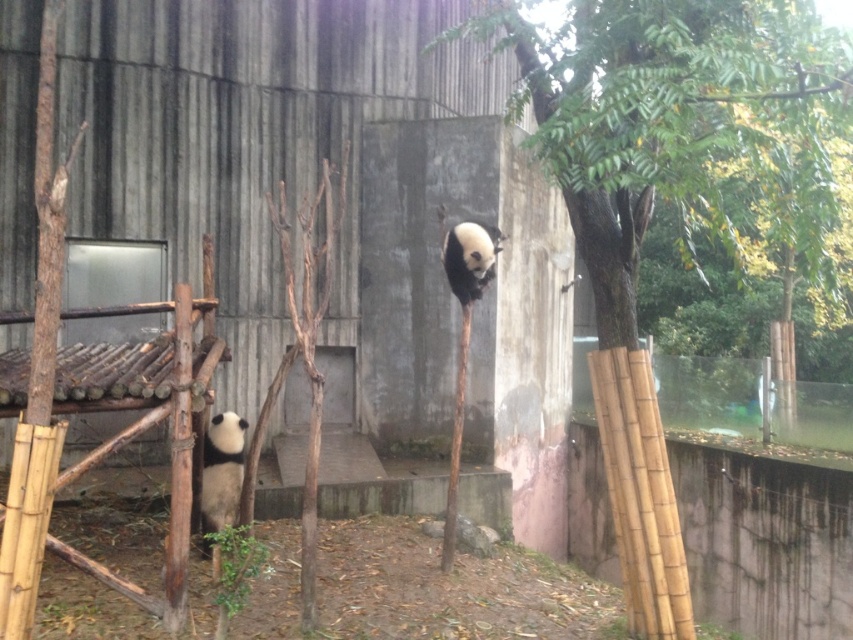
Between black and white fur panda at lower left and white fur panda at upper center, which one has more height?

black and white fur panda at lower left is taller.

Between black and white fur panda at lower left and white fur panda at upper center, which one is positioned higher?

white fur panda at upper center is higher up.

Between point (233, 445) and point (462, 273), which one is positioned behind?

Point (462, 273)

Find the location of a particular element. black and white fur panda at lower left is located at coordinates (221, 472).

Is point (715, 189) in front of point (498, 236)?

Yes, it is in front of point (498, 236).

Is point (560, 81) farther from camera compared to point (448, 268)?

No, it is in front of (448, 268).

Is point (811, 113) in front of point (474, 288)?

Yes, it is.

I want to click on green leafy tree at upper right, so click(x=675, y=122).

Is point (693, 634) more distant than point (206, 492)?

No, (693, 634) is in front of (206, 492).

Can you confirm if green leafy tree at upper right is wider than black and white fur panda at lower left?

Correct, the width of green leafy tree at upper right exceeds that of black and white fur panda at lower left.

Where is `green leafy tree at upper right`? green leafy tree at upper right is located at coordinates (675, 122).